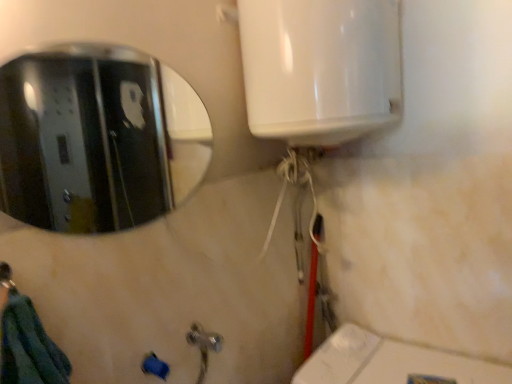
Question: Would you say brushed metal shower at lower left is outside polished metallic mirror at upper left?

Choices:
 (A) yes
 (B) no

Answer: (A)

Question: Could you tell me if brushed metal shower at lower left is facing polished metallic mirror at upper left?

Choices:
 (A) no
 (B) yes

Answer: (A)

Question: Is brushed metal shower at lower left closer to camera compared to polished metallic mirror at upper left?

Choices:
 (A) no
 (B) yes

Answer: (B)

Question: Could polished metallic mirror at upper left be considered to be inside brushed metal shower at lower left?

Choices:
 (A) no
 (B) yes

Answer: (A)

Question: Is brushed metal shower at lower left thinner than polished metallic mirror at upper left?

Choices:
 (A) yes
 (B) no

Answer: (B)

Question: Is brushed metal shower at lower left positioned with its back to polished metallic mirror at upper left?

Choices:
 (A) yes
 (B) no

Answer: (B)

Question: Is polished metallic mirror at upper left turned away from brushed metal shower at lower left?

Choices:
 (A) yes
 (B) no

Answer: (B)

Question: Does polished metallic mirror at upper left have a larger size compared to brushed metal shower at lower left?

Choices:
 (A) no
 (B) yes

Answer: (B)

Question: From the image's perspective, would you say polished metallic mirror at upper left is positioned over brushed metal shower at lower left?

Choices:
 (A) yes
 (B) no

Answer: (A)

Question: Is polished metallic mirror at upper left next to brushed metal shower at lower left?

Choices:
 (A) yes
 (B) no

Answer: (B)

Question: Would you say polished metallic mirror at upper left is outside brushed metal shower at lower left?

Choices:
 (A) yes
 (B) no

Answer: (A)

Question: Would you consider polished metallic mirror at upper left to be distant from brushed metal shower at lower left?

Choices:
 (A) no
 (B) yes

Answer: (B)

Question: Visually, is polished metallic mirror at upper left positioned to the left or to the right of brushed metal shower at lower left?

Choices:
 (A) left
 (B) right

Answer: (B)